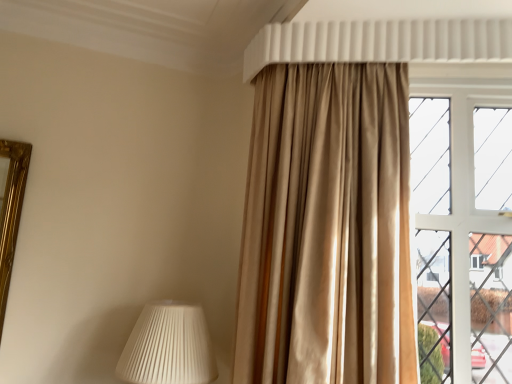
Question: Is white glass window at right oriented away from satin beige curtain at upper right?

Choices:
 (A) no
 (B) yes

Answer: (A)

Question: Is satin beige curtain at upper right completely or partially inside white glass window at right?

Choices:
 (A) yes
 (B) no

Answer: (B)

Question: Considering the relative positions of white glass window at right and satin beige curtain at upper right in the image provided, is white glass window at right to the right of satin beige curtain at upper right from the viewer's perspective?

Choices:
 (A) no
 (B) yes

Answer: (B)

Question: Would you say white glass window at right is outside satin beige curtain at upper right?

Choices:
 (A) no
 (B) yes

Answer: (B)

Question: Considering the relative sizes of white glass window at right and satin beige curtain at upper right in the image provided, is white glass window at right bigger than satin beige curtain at upper right?

Choices:
 (A) yes
 (B) no

Answer: (B)

Question: Can you confirm if white glass window at right is thinner than satin beige curtain at upper right?

Choices:
 (A) yes
 (B) no

Answer: (A)

Question: Does white pleated lampshade at lower left have a greater width compared to satin beige curtain at upper right?

Choices:
 (A) yes
 (B) no

Answer: (A)

Question: From the image's perspective, is white pleated lampshade at lower left on top of satin beige curtain at upper right?

Choices:
 (A) yes
 (B) no

Answer: (B)

Question: From the image's perspective, does white pleated lampshade at lower left appear lower than satin beige curtain at upper right?

Choices:
 (A) no
 (B) yes

Answer: (B)

Question: Does white pleated lampshade at lower left have a lesser height compared to satin beige curtain at upper right?

Choices:
 (A) yes
 (B) no

Answer: (A)

Question: Is white pleated lampshade at lower left next to satin beige curtain at upper right?

Choices:
 (A) no
 (B) yes

Answer: (A)

Question: Is white pleated lampshade at lower left not near satin beige curtain at upper right?

Choices:
 (A) yes
 (B) no

Answer: (B)

Question: Can you confirm if white pleated lampshade at lower left is wider than white glass window at right?

Choices:
 (A) no
 (B) yes

Answer: (B)